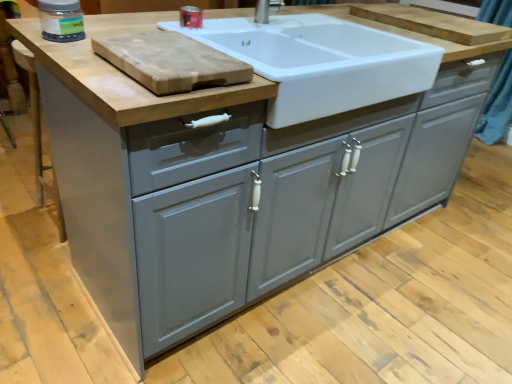
Question: Based on their sizes in the image, would you say transparent plastic jar at upper left, which is counted as the first appliance, starting from the left, is bigger or smaller than wooden cutting board at upper center, the 1th cutting board when ordered from back to front?

Choices:
 (A) small
 (B) big

Answer: (A)

Question: Is point pyautogui.click(x=65, y=6) positioned closer to the camera than point pyautogui.click(x=417, y=21)?

Choices:
 (A) closer
 (B) farther

Answer: (A)

Question: Based on their relative distances, which object is farther from the transparent plastic jar at upper left, which is counted as the 2th appliance, starting from the back?

Choices:
 (A) natural wood cutting board at upper left, which ranks as the 1th cutting board in front-to-back order
 (B) wooden cutting board at upper center, the 1th cutting board when ordered from back to front
 (C) matte plastic container at upper center, arranged as the 1th appliance when viewed from the back
 (D) white glossy sink at upper center

Answer: (B)

Question: Which is farther from the matte plastic container at upper center, the second appliance positioned from the front?

Choices:
 (A) white glossy sink at upper center
 (B) transparent plastic jar at upper left, the 2th appliance viewed from the right
 (C) natural wood cutting board at upper left, which appears as the first cutting board when ordered from the bottom
 (D) wooden cutting board at upper center, marked as the 2th cutting board in a front-to-back arrangement

Answer: (D)